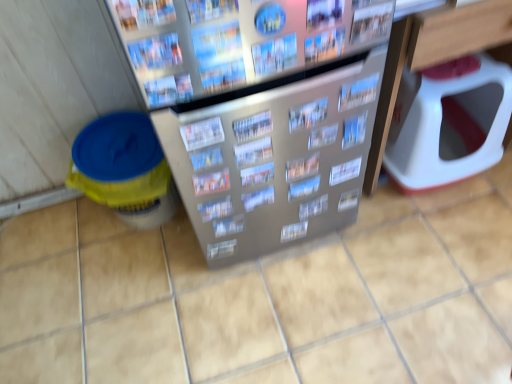
Locate an element on the screen. vacant area that is in front of yellow plastic bucket at left is located at coordinates (136, 281).